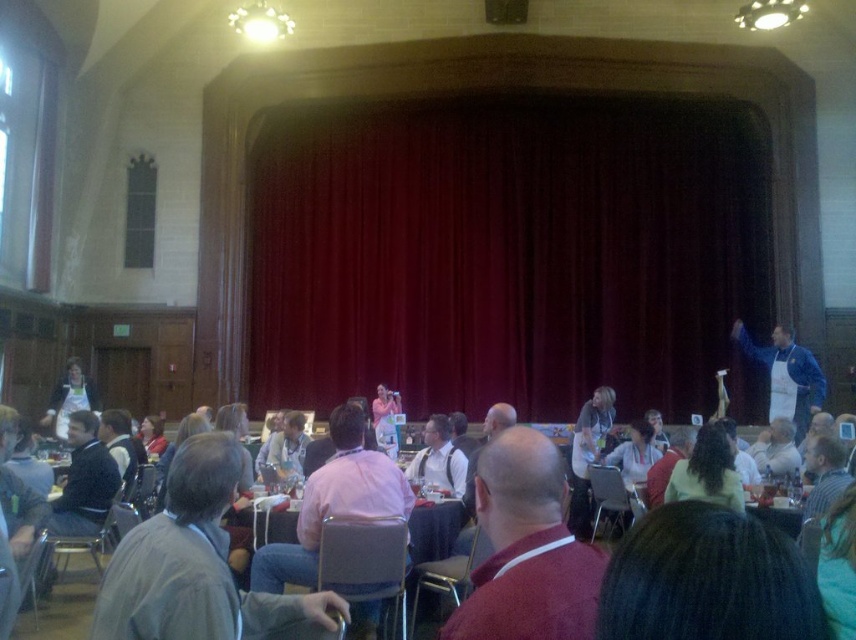
You are standing in the front of the stage and want to retrieve your gray fabric jacket at lower left. Which direction should you move to reach it?

The gray fabric jacket at lower left is located at point (194, 563), so you should move towards the lower left direction to reach it.